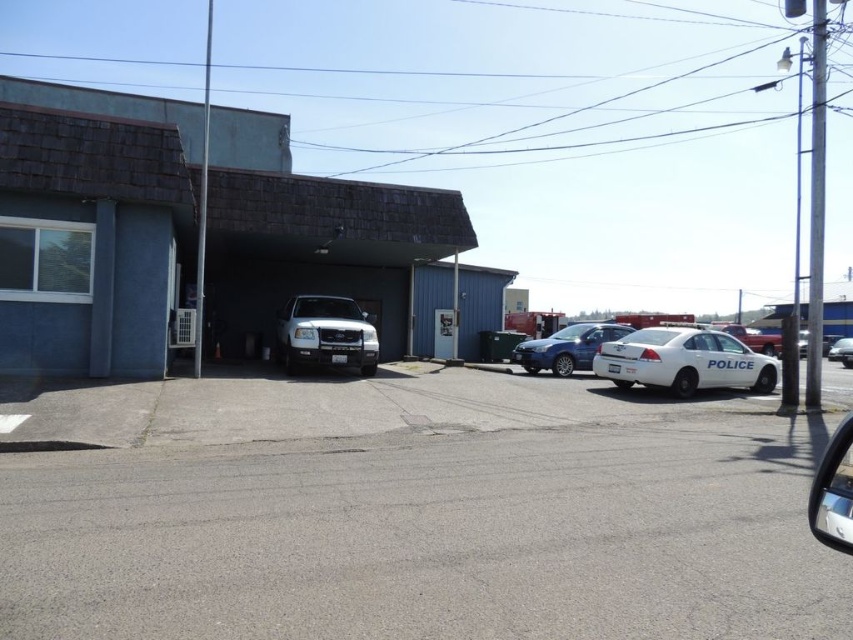
Question: Which object is closer to the camera taking this photo?

Choices:
 (A) white matte suv at center
 (B) satin blue sedan at center
 (C) white glossy police car at right

Answer: (A)

Question: Based on their relative distances, which object is nearer to the white glossy police car at right?

Choices:
 (A) white glossy police car at center-right
 (B) white matte sedan at center
 (C) gray asphalt parking lot at lower left
 (D) white matte suv at center

Answer: (D)

Question: From the image, what is the correct spatial relationship of white matte suv at center in relation to satin blue sedan at center?

Choices:
 (A) below
 (B) above

Answer: (B)

Question: Does gray asphalt parking lot at lower left have a smaller size compared to white matte suv at center?

Choices:
 (A) yes
 (B) no

Answer: (B)

Question: Considering the relative positions of gray asphalt parking lot at lower left and white matte sedan at center in the image provided, where is gray asphalt parking lot at lower left located with respect to white matte sedan at center?

Choices:
 (A) below
 (B) above

Answer: (A)

Question: Based on their relative distances, which object is farther from the white matte sedan at center?

Choices:
 (A) white glossy police car at center-right
 (B) satin blue sedan at center

Answer: (B)